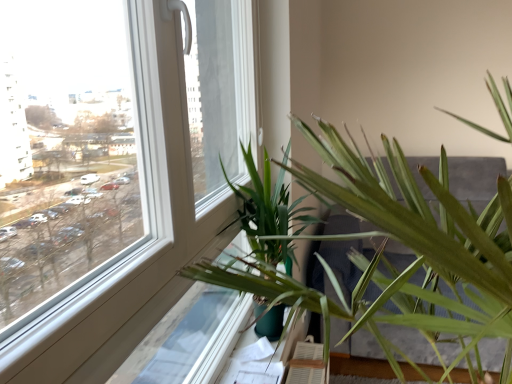
Question: From a real-world perspective, is green matte plant at lower center over green plastic at lower center?

Choices:
 (A) yes
 (B) no

Answer: (A)

Question: Does green matte plant at lower center come behind green plastic at lower center?

Choices:
 (A) yes
 (B) no

Answer: (B)

Question: Can you confirm if green matte plant at lower center is shorter than green plastic at lower center?

Choices:
 (A) no
 (B) yes

Answer: (A)

Question: From a real-world perspective, does green matte plant at lower center sit lower than green plastic at lower center?

Choices:
 (A) no
 (B) yes

Answer: (A)

Question: Is green matte plant at lower center next to green plastic at lower center?

Choices:
 (A) yes
 (B) no

Answer: (B)

Question: From a real-world perspective, relative to green leafy palm at center, is green plastic at lower center vertically above or below?

Choices:
 (A) below
 (B) above

Answer: (A)

Question: From their relative heights in the image, would you say green plastic at lower center is taller or shorter than green leafy palm at center?

Choices:
 (A) short
 (B) tall

Answer: (A)

Question: Would you say green plastic at lower center is to the left or to the right of green leafy palm at center in the picture?

Choices:
 (A) left
 (B) right

Answer: (A)

Question: Relative to green leafy palm at center, is green plastic at lower center in front or behind?

Choices:
 (A) front
 (B) behind

Answer: (B)

Question: Which is correct: green leafy palm at center is inside green matte plant at lower center, or outside of it?

Choices:
 (A) inside
 (B) outside

Answer: (A)

Question: Considering the positions of point (268, 208) and point (276, 278), is point (268, 208) closer or farther from the camera than point (276, 278)?

Choices:
 (A) farther
 (B) closer

Answer: (A)

Question: Is green leafy palm at center taller or shorter than green matte plant at lower center?

Choices:
 (A) short
 (B) tall

Answer: (A)

Question: Is green leafy palm at center in front of or behind green matte plant at lower center in the image?

Choices:
 (A) behind
 (B) front

Answer: (A)

Question: Is green leafy palm at center situated inside green plastic at lower center or outside?

Choices:
 (A) inside
 (B) outside

Answer: (B)

Question: From the image's perspective, is green leafy palm at center positioned above or below green plastic at lower center?

Choices:
 (A) above
 (B) below

Answer: (A)